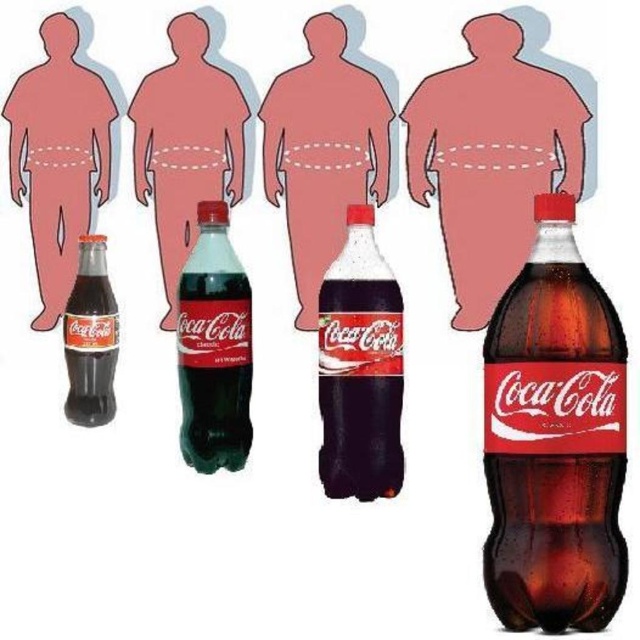
Does translucent glass coca-cola bottle at center have a lesser width compared to dark glass coca-cola bottle at center?

In fact, translucent glass coca-cola bottle at center might be wider than dark glass coca-cola bottle at center.

Is translucent glass coca-cola bottle at center further to camera compared to dark glass coca-cola bottle at center?

No, it is in front of dark glass coca-cola bottle at center.

Locate an element on the screen. translucent glass coca-cola bottle at center is located at coordinates (554, 438).

Does dark glass coca-cola bottle at center appear over green glass coca-cola bottle at center?

Actually, dark glass coca-cola bottle at center is below green glass coca-cola bottle at center.

Is dark glass coca-cola bottle at center shorter than green glass coca-cola bottle at center?

Incorrect, dark glass coca-cola bottle at center's height does not fall short of green glass coca-cola bottle at center's.

Is point (340, 259) farther from viewer compared to point (193, 378)?

That is False.

Locate an element on the screen. dark glass coca-cola bottle at center is located at coordinates (358, 369).

Is translucent plastic bottle at center taller than green glass coca-cola bottle at center?

Correct, translucent plastic bottle at center is much taller as green glass coca-cola bottle at center.

Does point (241, 118) come behind point (196, 209)?

Yes.

Is point (157, 212) farther from camera compared to point (179, 346)?

Yes, point (157, 212) is behind point (179, 346).

Identify the location of translucent plastic bottle at center. The width and height of the screenshot is (640, 640). (186, 145).